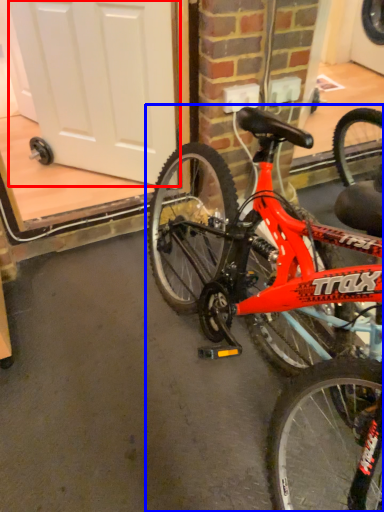
Question: Which object appears farthest to the camera in this image, screen door (highlighted by a red box) or bicycle (highlighted by a blue box)?

Choices:
 (A) screen door
 (B) bicycle

Answer: (A)